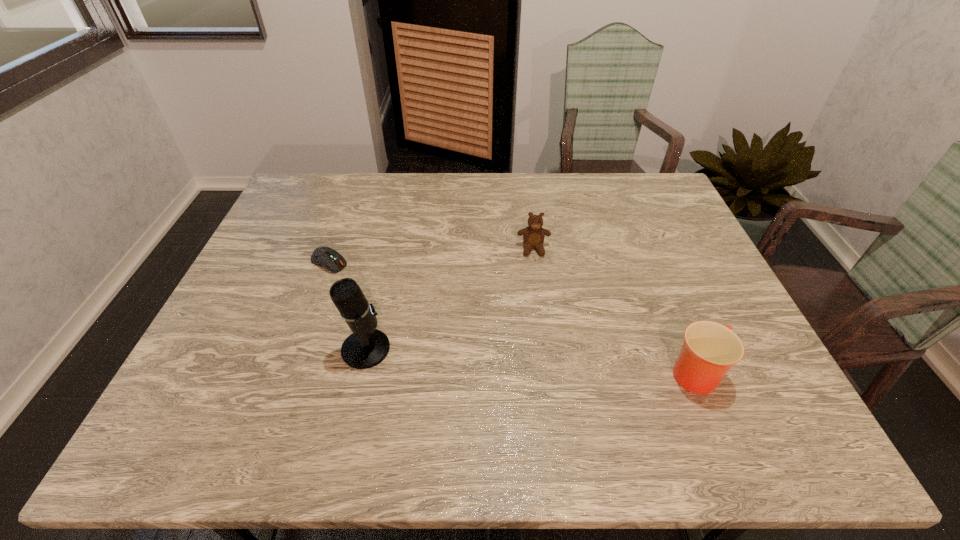
The image size is (960, 540). What are the coordinates of `the tallest object` in the screenshot? It's located at (366, 347).

You are a GUI agent. You are given a task and a screenshot of the screen. Output one action in this format:
    pyautogui.click(x=<x>, y=<y>)
    Task: Click on the microphone
    This screenshot has width=960, height=540.
    Given the screenshot: What is the action you would take?
    pos(366,347)

You are a GUI agent. You are given a task and a screenshot of the screen. Output one action in this format:
    pyautogui.click(x=<x>, y=<y>)
    Task: Click on the cup
    
    Given the screenshot: What is the action you would take?
    pyautogui.click(x=710, y=349)

Where is `the shortest object`? This screenshot has width=960, height=540. the shortest object is located at coordinates click(326, 257).

What are the coordinates of `computer equipment` in the screenshot? It's located at (326, 257).

Find the location of a particular element. This screenshot has width=960, height=540. the second object from right to left is located at coordinates (533, 236).

This screenshot has height=540, width=960. Find the location of `free spot located on the right of the tallest object`. free spot located on the right of the tallest object is located at coordinates (492, 349).

The height and width of the screenshot is (540, 960). Find the location of `free space located 0.050m on the right of the cup`. free space located 0.050m on the right of the cup is located at coordinates [750, 374].

You are a GUI agent. You are given a task and a screenshot of the screen. Output one action in this format:
    pyautogui.click(x=<x>, y=<y>)
    Task: Click on the vacant area situated 0.120m on the button of the leftmost object
    
    Given the screenshot: What is the action you would take?
    pyautogui.click(x=372, y=288)

The height and width of the screenshot is (540, 960). What are the coordinates of `free space located 0.250m on the button of the leftmost object` in the screenshot? It's located at (407, 310).